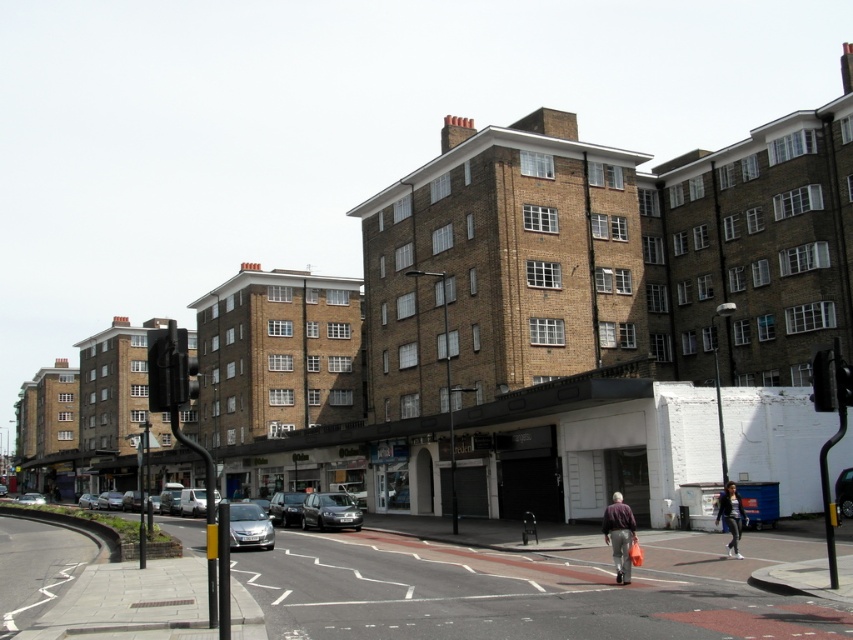
You are a pedestrian standing at the pedestrian crossing. You see a satin silver car at lower center and a shiny black car at center. Which car is closer to you?

The satin silver car at lower center is closer to you because it is in front of the shiny black car at center.